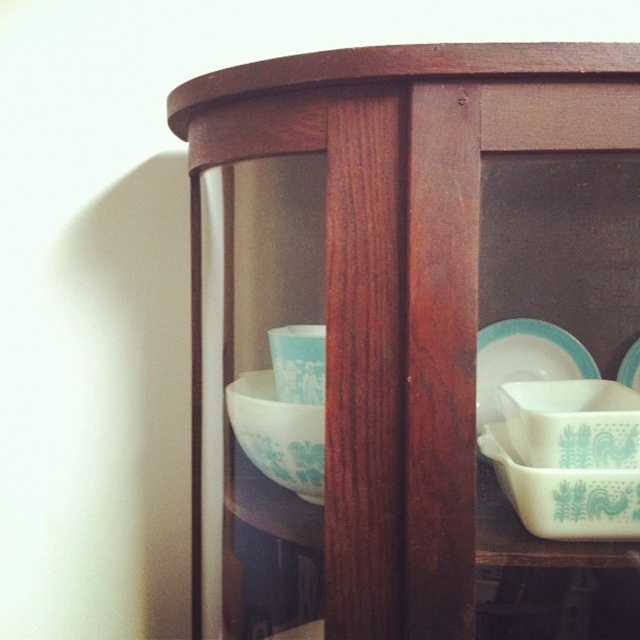
You are organizing items in a kitchen and need to place the white glossy casserole dish at right into the wooden cabinet at center. Based on the scene, can the casserole dish fit inside the cabinet?

The wooden cabinet at center is larger in size than the white glossy casserole dish at right, so yes, the casserole dish can fit inside the cabinet.

You are organizing items in a cabinet and need to place a new item between the wooden cabinet at center and the white glossy plate at center. Based on their positions, where should you place the new item?

The wooden cabinet at center is to the left of the white glossy plate at center. Therefore, you should place the new item between them to the right of the wooden cabinet at center and to the left of the white glossy plate at center.

You are organizing items in a cabinet and want to stack the white glossy casserole dish at right on top of the white glossy plate at center. Can you do this without the dish falling off?

The white glossy casserole dish at right is shorter than the white glossy plate at center, so it can be safely stacked on top without falling off.